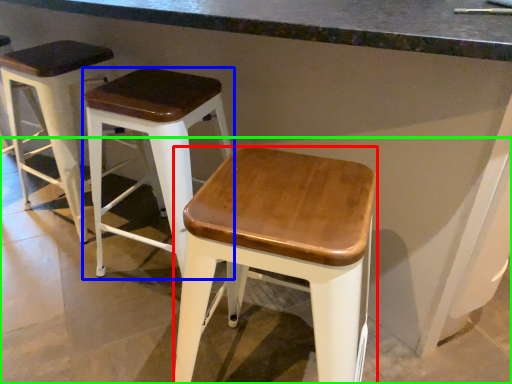
Question: Considering the real-world distances, which object is farthest from stool (highlighted by a red box)? stool (highlighted by a blue box) or concrete (highlighted by a green box)?

Choices:
 (A) stool
 (B) concrete

Answer: (B)